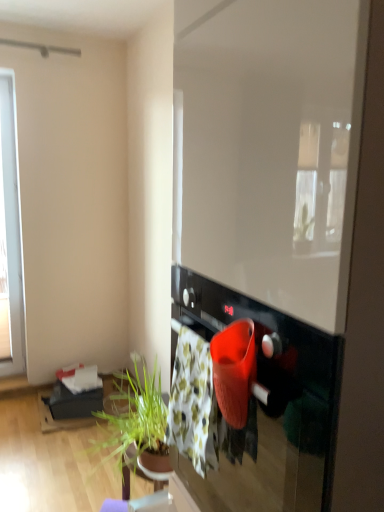
Question: Is transparent glass window screen at center wider than floral cotton blanket at center?

Choices:
 (A) yes
 (B) no

Answer: (A)

Question: Is transparent glass window screen at center facing towards floral cotton blanket at center?

Choices:
 (A) yes
 (B) no

Answer: (A)

Question: Is transparent glass window screen at center far away from floral cotton blanket at center?

Choices:
 (A) no
 (B) yes

Answer: (A)

Question: Is transparent glass window screen at center located outside floral cotton blanket at center?

Choices:
 (A) no
 (B) yes

Answer: (B)

Question: Is transparent glass window screen at center to the left of floral cotton blanket at center from the viewer's perspective?

Choices:
 (A) yes
 (B) no

Answer: (B)

Question: Do you think transparent glass window screen at center is within floral cotton blanket at center, or outside of it?

Choices:
 (A) outside
 (B) inside

Answer: (A)

Question: Relative to floral cotton blanket at center, is transparent glass window screen at center in front or behind?

Choices:
 (A) behind
 (B) front

Answer: (B)

Question: Does point (196, 246) appear closer or farther from the camera than point (170, 387)?

Choices:
 (A) closer
 (B) farther

Answer: (A)

Question: From the image's perspective, is transparent glass window screen at center located above or below floral cotton blanket at center?

Choices:
 (A) above
 (B) below

Answer: (A)

Question: Is black glossy oven at center taller or shorter than transparent glass window screen at center?

Choices:
 (A) short
 (B) tall

Answer: (A)

Question: Does point (182, 283) appear closer or farther from the camera than point (339, 300)?

Choices:
 (A) closer
 (B) farther

Answer: (B)

Question: Is black glossy oven at center inside the boundaries of transparent glass window screen at center, or outside?

Choices:
 (A) inside
 (B) outside

Answer: (A)

Question: Would you say black glossy oven at center is to the left or to the right of transparent glass window screen at center in the picture?

Choices:
 (A) left
 (B) right

Answer: (A)

Question: From a real-world perspective, is floral cotton blanket at center positioned above or below transparent glass window screen at center?

Choices:
 (A) below
 (B) above

Answer: (A)

Question: Considering the positions of floral cotton blanket at center and transparent glass window screen at center in the image, is floral cotton blanket at center bigger or smaller than transparent glass window screen at center?

Choices:
 (A) small
 (B) big

Answer: (A)